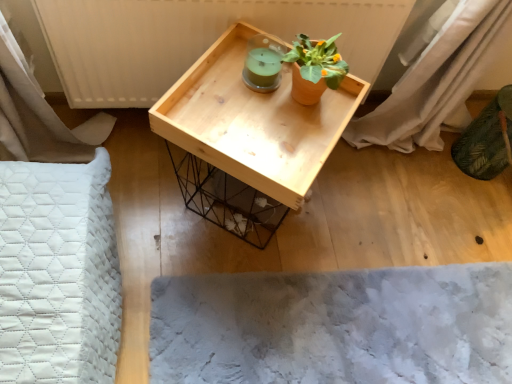
Locate an element on the screen. The width and height of the screenshot is (512, 384). vacant area situated to the left side of natural wood tray at center is located at coordinates (145, 182).